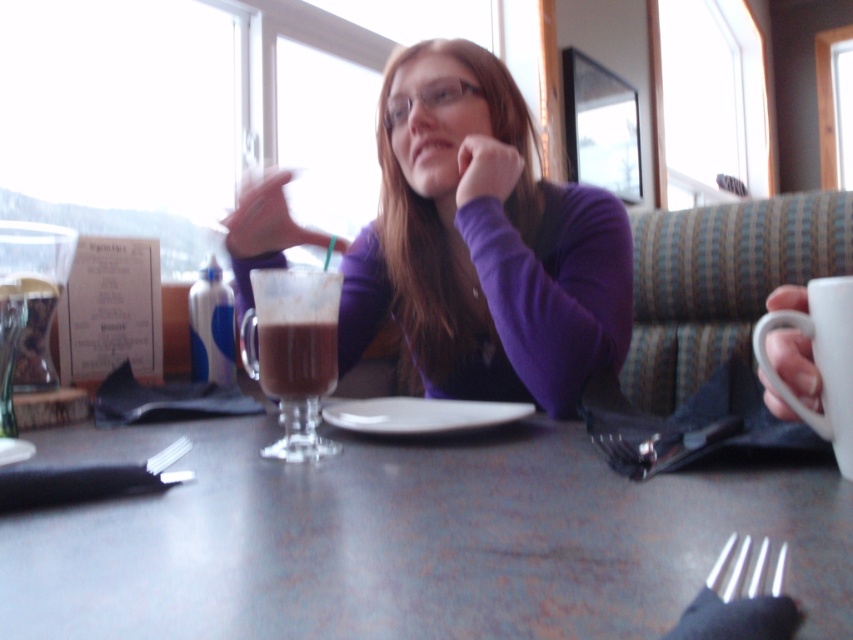
Between purple matte hand at center and white plastic fork at lower center, which one is positioned higher?

Positioned higher is purple matte hand at center.

Is purple matte hand at center shorter than white plastic fork at lower center?

Incorrect, purple matte hand at center's height does not fall short of white plastic fork at lower center's.

What do you see at coordinates (485, 168) in the screenshot?
I see `purple matte hand at center` at bounding box center [485, 168].

The image size is (853, 640). In order to click on purple matte hand at center in this screenshot , I will do `click(485, 168)`.

Is purple matte shirt at center thinner than silver metallic fork at lower right?

No, purple matte shirt at center is not thinner than silver metallic fork at lower right.

Is purple matte shirt at center above silver metallic fork at lower right?

Yes, purple matte shirt at center is above silver metallic fork at lower right.

Measure the distance between purple matte shirt at center and camera.

purple matte shirt at center is 90.41 centimeters from camera.

Where is `purple matte shirt at center`? The width and height of the screenshot is (853, 640). purple matte shirt at center is located at coordinates (483, 248).

Is matte plastic cup at center bigger than translucent glass cup at left?

Indeed, matte plastic cup at center has a larger size compared to translucent glass cup at left.

Can you confirm if matte plastic cup at center is wider than translucent glass cup at left?

Correct, the width of matte plastic cup at center exceeds that of translucent glass cup at left.

What do you see at coordinates (262, 218) in the screenshot? I see `matte plastic cup at center` at bounding box center [262, 218].

In order to click on matte plastic cup at center in this screenshot , I will do `click(262, 218)`.